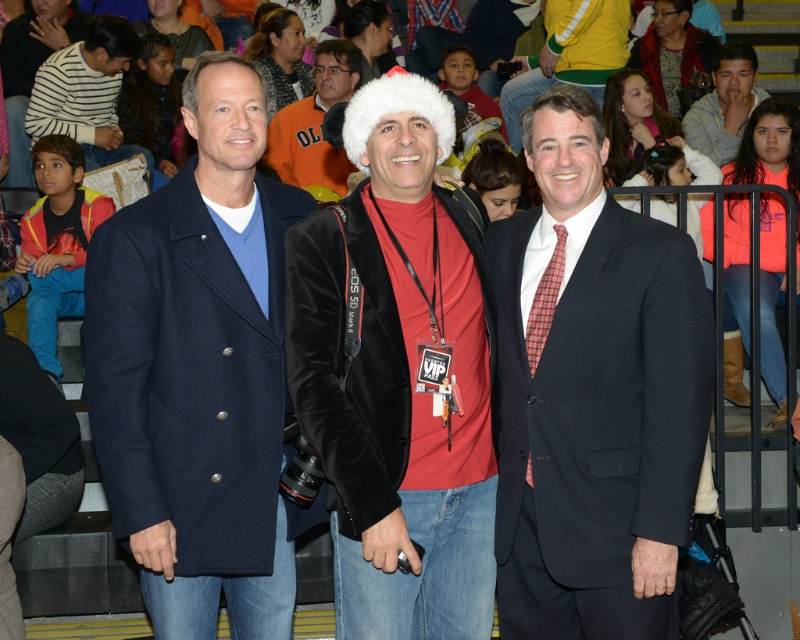
You are a photographer at the event and need to adjust the lighting so that both the striped sweater at left and the velvet jacket at center are well lit. Which object should you focus on first to ensure proper exposure, considering their sizes?

The striped sweater at left is much taller than the velvet jacket at center, so you should focus on the striped sweater at left first to ensure its height is properly exposed.

You are standing in the gymnasium and see two points marked in the image. The first point is at coordinates point (250, 220) and the second point is at point (752, 80). Which point is closer to you?

Point (250, 220) is closer to the viewer than point (752, 80).

You are standing in the gymnasium and want to take a photo of the velvet black jacket at center. Where should you position yourself to capture it in the center of your camera viewfinder?

Position yourself directly in front of the velvet black jacket at center, as its 2D coordinates are at the center point of the image, making it easy to frame in the camera viewfinder.